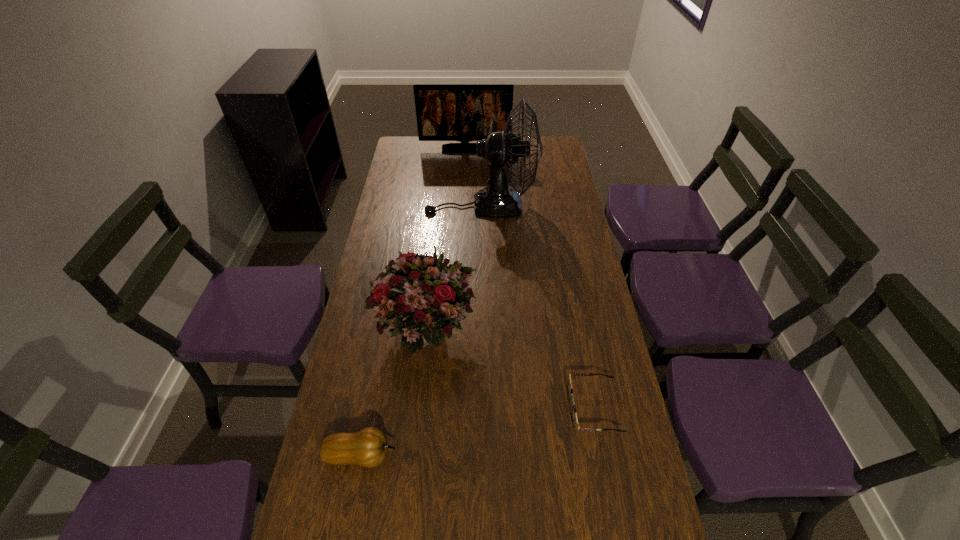
In order to click on the tallest object in this screenshot , I will do `click(501, 149)`.

Locate an element on the screen. This screenshot has width=960, height=540. the second farthest object is located at coordinates (501, 149).

Where is `the farthest object`? The width and height of the screenshot is (960, 540). the farthest object is located at coordinates (445, 112).

Locate an element on the screen. The image size is (960, 540). bouquet is located at coordinates (424, 299).

What are the coordinates of `the nearest object` in the screenshot? It's located at (368, 447).

You are a GUI agent. You are given a task and a screenshot of the screen. Output one action in this format:
    pyautogui.click(x=<x>, y=<y>)
    Task: Click on the gourd
    The width and height of the screenshot is (960, 540).
    Given the screenshot: What is the action you would take?
    click(x=368, y=447)

You are a GUI agent. You are given a task and a screenshot of the screen. Output one action in this format:
    pyautogui.click(x=<x>, y=<y>)
    Task: Click on the rightmost object
    
    Given the screenshot: What is the action you would take?
    pyautogui.click(x=574, y=418)

You are a GUI agent. You are given a task and a screenshot of the screen. Output one action in this format:
    pyautogui.click(x=<x>, y=<y>)
    Task: Click on the shortest object
    Image resolution: width=960 pixels, height=540 pixels.
    Given the screenshot: What is the action you would take?
    pyautogui.click(x=574, y=418)

Where is `free space located in front of the tallest object, indicating the direction of air flow`? The height and width of the screenshot is (540, 960). free space located in front of the tallest object, indicating the direction of air flow is located at coordinates (401, 205).

Locate an element on the screen. Image resolution: width=960 pixels, height=540 pixels. blank area located in front of the tallest object, indicating the direction of air flow is located at coordinates (396, 205).